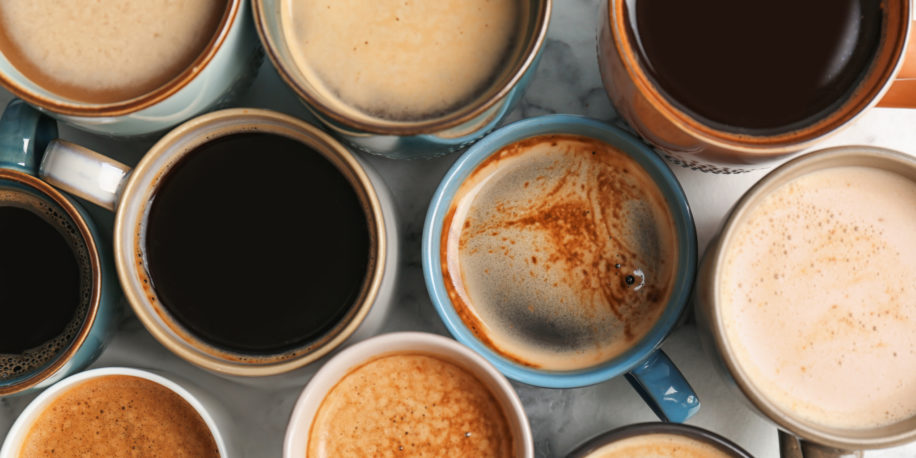
Image resolution: width=916 pixels, height=458 pixels. I want to click on cups of coffee, so (113, 50), (374, 57), (285, 224), (510, 239), (417, 389), (780, 314), (726, 77), (121, 410), (41, 281).